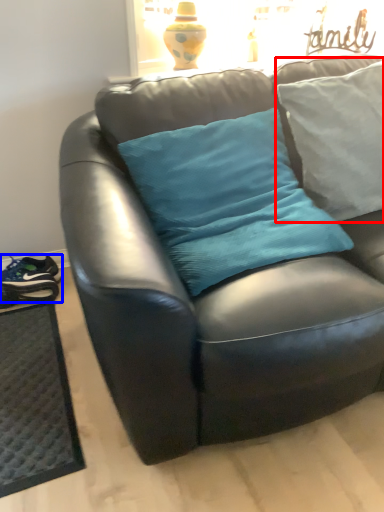
Question: Among these objects, which one is nearest to the camera, pillow (highlighted by a red box) or footwear (highlighted by a blue box)?

Choices:
 (A) pillow
 (B) footwear

Answer: (A)